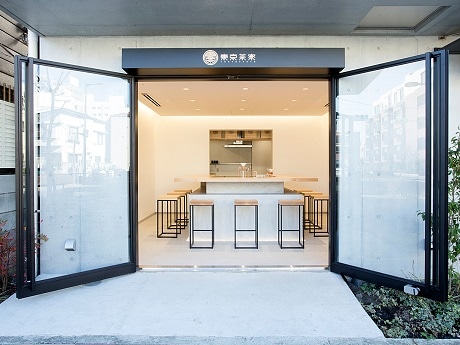
Identify the location of glass door. (68, 105), (401, 151).